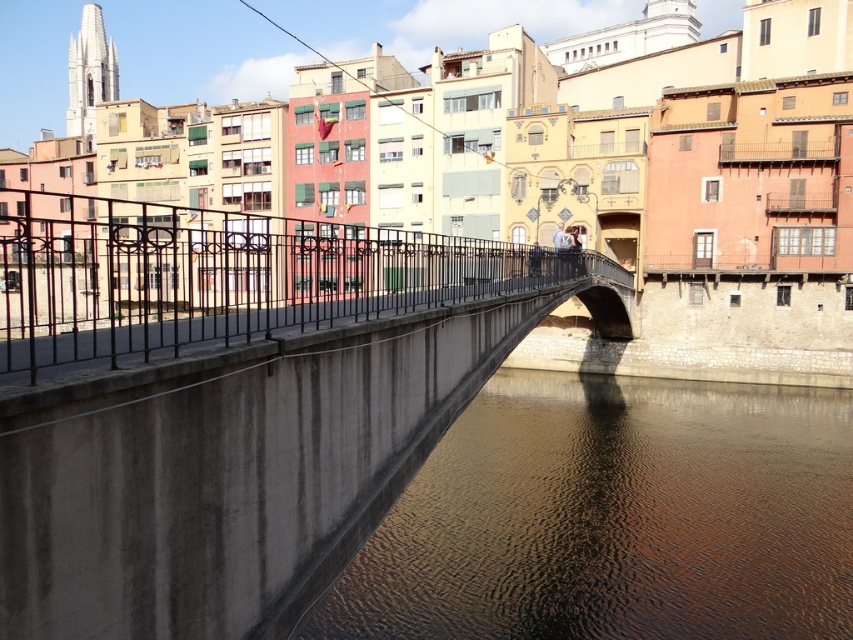
Can you confirm if concrete bridge at center is positioned to the right of black wrought iron railing at center?

Yes, concrete bridge at center is to the right of black wrought iron railing at center.

Is concrete bridge at center wider than black wrought iron railing at center?

No, concrete bridge at center is not wider than black wrought iron railing at center.

Locate an element on the screen. The width and height of the screenshot is (853, 640). concrete bridge at center is located at coordinates (234, 403).

Find the location of a particular element. This screenshot has height=640, width=853. concrete bridge at center is located at coordinates (234, 403).

How distant is concrete bridge at center from brown concrete water at lower center?

A distance of 21.36 meters exists between concrete bridge at center and brown concrete water at lower center.

Where is `concrete bridge at center`? The height and width of the screenshot is (640, 853). concrete bridge at center is located at coordinates (234, 403).

Is brown concrete water at lower center to the left of black wrought iron railing at center from the viewer's perspective?

Incorrect, brown concrete water at lower center is not on the left side of black wrought iron railing at center.

Who is more distant from viewer, (x=566, y=449) or (x=497, y=244)?

Positioned behind is point (x=497, y=244).

Where is `brown concrete water at lower center`? brown concrete water at lower center is located at coordinates (614, 516).